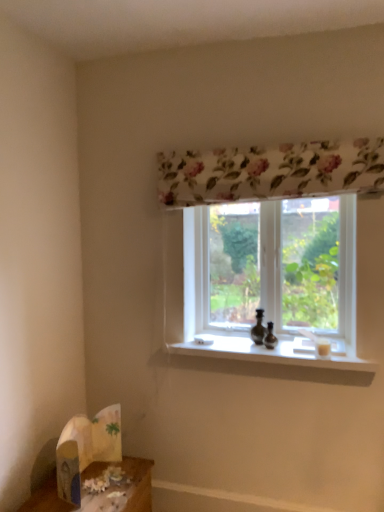
In order to click on free spot above white smooth window sill at center (from a real-world perspective) in this screenshot , I will do `click(261, 345)`.